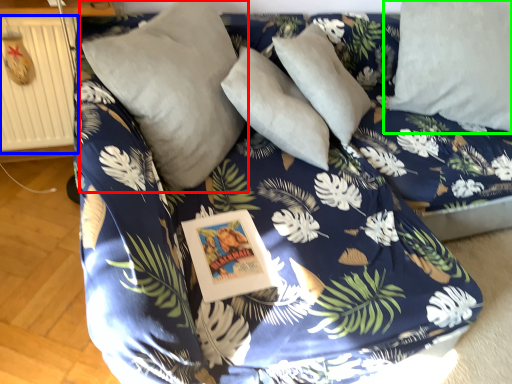
Question: Based on their relative distances, which object is farther from pillow (highlighted by a red box)? Choose from radiator (highlighted by a blue box) and pillow (highlighted by a green box).

Choices:
 (A) radiator
 (B) pillow

Answer: (B)